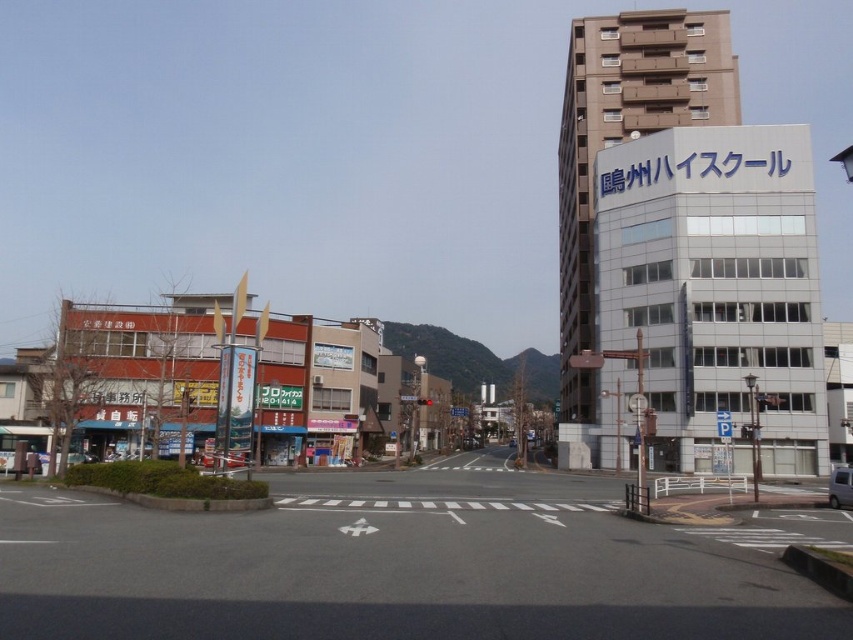
You are a delivery driver needing to park your vehicle. You have two options in the scene, a silver metallic van at lower right and a metallic silver car at center. Which vehicle takes up more space in the parking spot?

The silver metallic van at lower right is larger in size than the metallic silver car at center, so it takes up more space in the parking spot.

You are a delivery person needing to park your metallic silver car at center on the black asphalt road at center. Can your car fit entirely within the road without crossing any lines?

The black asphalt road at center is wider than the metallic silver car at center, so yes, the car can fit entirely within the road without crossing any lines.